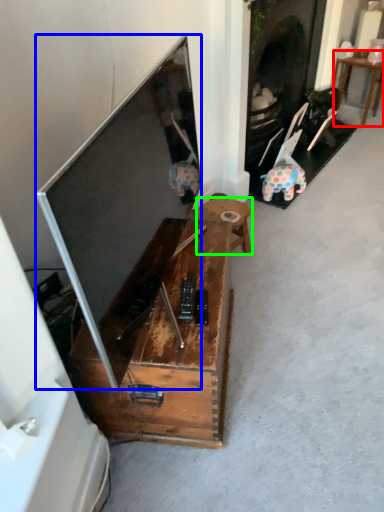
Question: Based on their relative distances, which object is farther from table (highlighted by a red box)? Choose from television (highlighted by a blue box) and table (highlighted by a green box).

Choices:
 (A) television
 (B) table

Answer: (A)